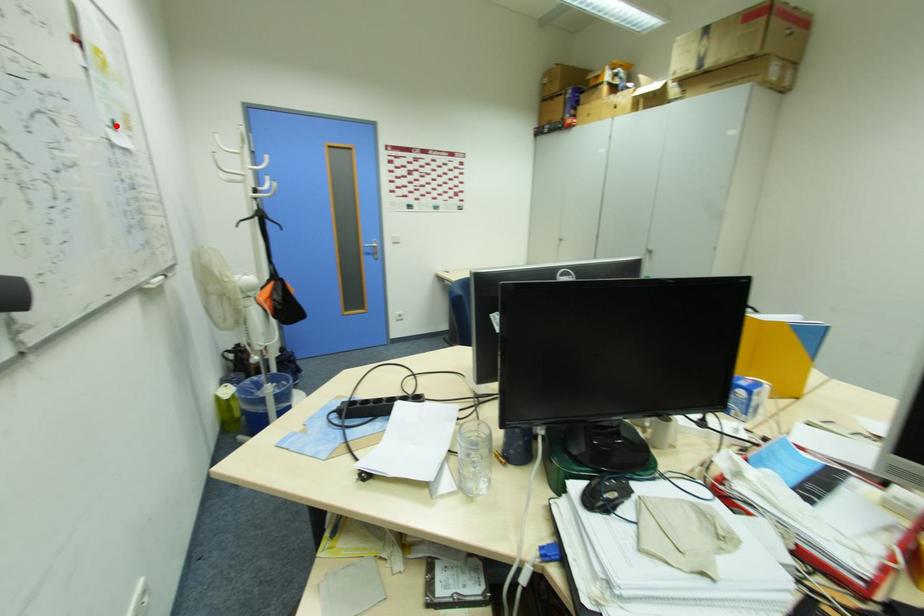
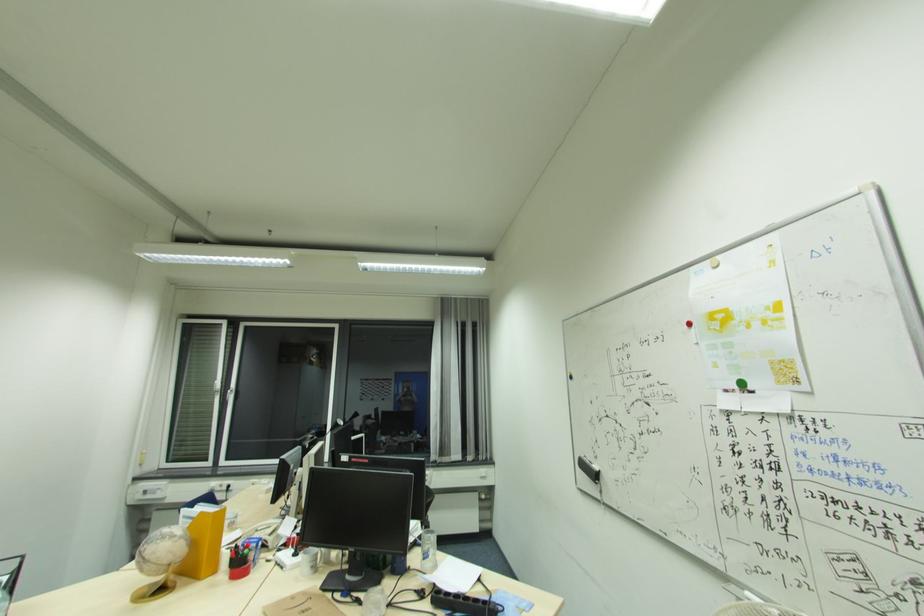
The point at the highlighted location is marked in the first image. Where is the corresponding point in the second image?

(739, 387)